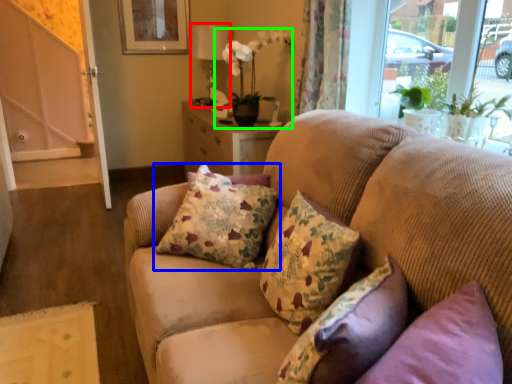
Question: Which object is the closest to the lamp (highlighted by a red box)? Choose among these: pillow (highlighted by a blue box) or houseplant (highlighted by a green box).

Choices:
 (A) pillow
 (B) houseplant

Answer: (B)